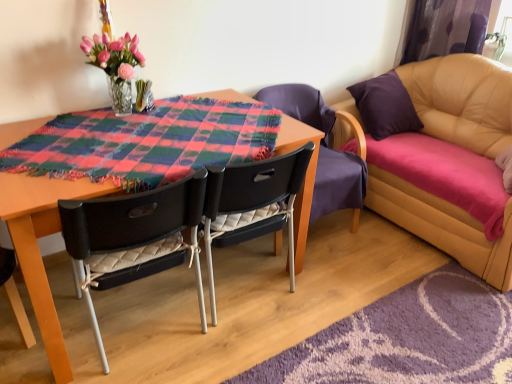
Question: Is black quilted fabric chair at center, acting as the first chair starting from the left, touching black plastic chair at center, the second chair from the right?

Choices:
 (A) no
 (B) yes

Answer: (A)

Question: Does black quilted fabric chair at center, the third chair positioned from the right, have a smaller size compared to black plastic chair at center, the second chair from the right?

Choices:
 (A) no
 (B) yes

Answer: (A)

Question: From the image's perspective, would you say black quilted fabric chair at center, the third chair positioned from the right, is shown under black plastic chair at center, the second chair from the right?

Choices:
 (A) yes
 (B) no

Answer: (A)

Question: Is black quilted fabric chair at center, the third chair positioned from the right, further to camera compared to black plastic chair at center, the second chair from the right?

Choices:
 (A) no
 (B) yes

Answer: (A)

Question: Can you confirm if black quilted fabric chair at center, acting as the first chair starting from the left, is positioned to the left of black plastic chair at center, marked as the second chair in a left-to-right arrangement?

Choices:
 (A) no
 (B) yes

Answer: (B)

Question: In the image, is translucent glass vase at upper left on the left side or the right side of black plastic chair at center, the second chair from the right?

Choices:
 (A) right
 (B) left

Answer: (B)

Question: From a real-world perspective, is translucent glass vase at upper left above or below black plastic chair at center, the second chair from the right?

Choices:
 (A) below
 (B) above

Answer: (B)

Question: In terms of width, does translucent glass vase at upper left look wider or thinner when compared to black plastic chair at center, the second chair from the right?

Choices:
 (A) wide
 (B) thin

Answer: (B)

Question: Would you say translucent glass vase at upper left is inside or outside black plastic chair at center, the second chair from the right?

Choices:
 (A) inside
 (B) outside

Answer: (B)

Question: From the image's perspective, is purple fabric curtain at upper right above or below black plastic chair at center, marked as the second chair in a left-to-right arrangement?

Choices:
 (A) below
 (B) above

Answer: (B)

Question: Do you think purple fabric curtain at upper right is within black plastic chair at center, marked as the second chair in a left-to-right arrangement, or outside of it?

Choices:
 (A) outside
 (B) inside

Answer: (A)

Question: From a real-world perspective, is purple fabric curtain at upper right physically located above or below black plastic chair at center, the second chair from the right?

Choices:
 (A) above
 (B) below

Answer: (A)

Question: Is point (444, 6) positioned closer to the camera than point (230, 195)?

Choices:
 (A) closer
 (B) farther

Answer: (B)

Question: Is black quilted chair at center, the third chair from the left, wider or thinner than black plastic chair at center, the second chair from the right?

Choices:
 (A) wide
 (B) thin

Answer: (A)

Question: From their relative heights in the image, would you say black quilted chair at center, marked as the 1th chair in a right-to-left arrangement, is taller or shorter than black plastic chair at center, the second chair from the right?

Choices:
 (A) short
 (B) tall

Answer: (B)